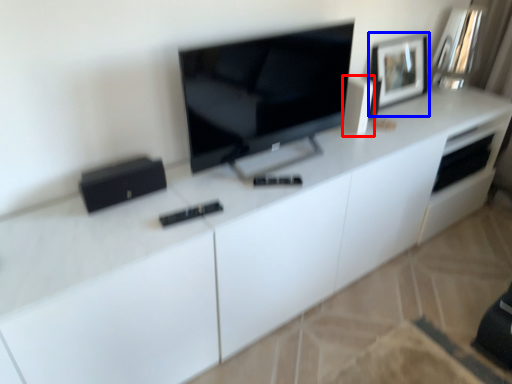
Question: Which point is closer to the camera, appliance (highlighted by a red box) or picture frame (highlighted by a blue box)?

Choices:
 (A) appliance
 (B) picture frame

Answer: (A)